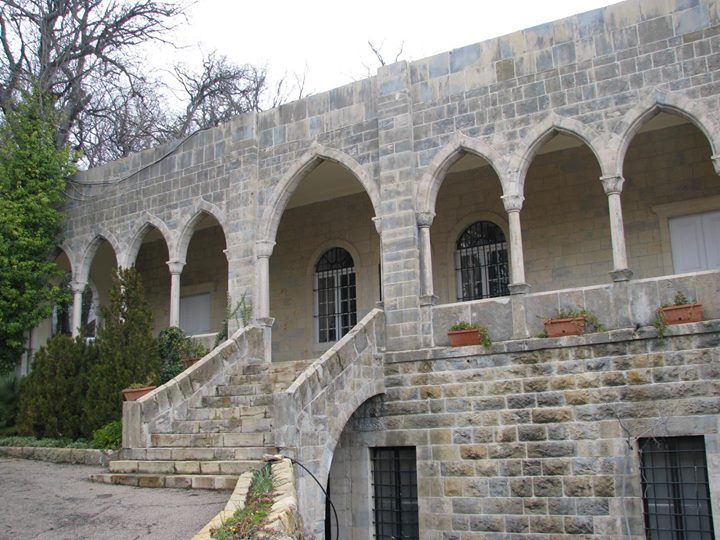
Identify the location of plant. (261, 490), (261, 501), (251, 521), (230, 532), (130, 387), (186, 360), (464, 327), (579, 316), (675, 305).